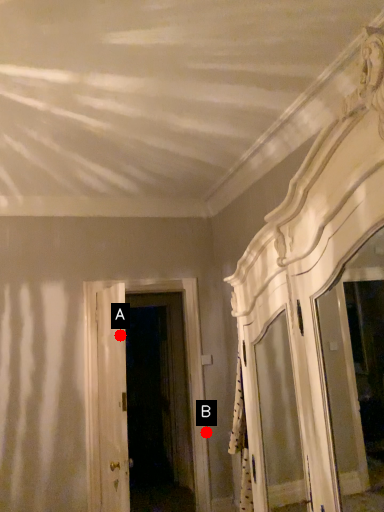
Question: Two points are circled on the image, labeled by A and B beside each circle. Which of the following is the closest to the observer?

Choices:
 (A) A is closer
 (B) B is closer

Answer: (A)